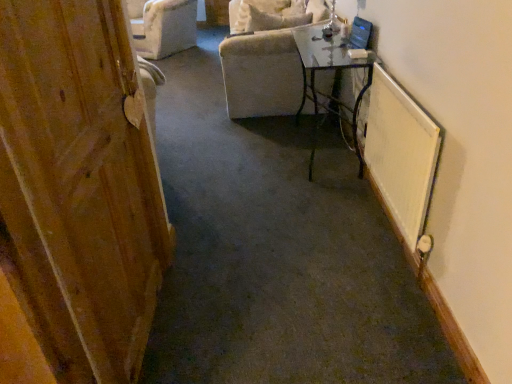
Question: Would you say velvet beige armchair at upper center is outside clear glass table at center?

Choices:
 (A) yes
 (B) no

Answer: (A)

Question: Considering the relative sizes of velvet beige armchair at upper center and clear glass table at center in the image provided, is velvet beige armchair at upper center smaller than clear glass table at center?

Choices:
 (A) no
 (B) yes

Answer: (B)

Question: From the image's perspective, would you say velvet beige armchair at upper center is shown under clear glass table at center?

Choices:
 (A) no
 (B) yes

Answer: (A)

Question: Is velvet beige armchair at upper center beside clear glass table at center?

Choices:
 (A) yes
 (B) no

Answer: (B)

Question: Considering the relative sizes of velvet beige armchair at upper center and clear glass table at center in the image provided, is velvet beige armchair at upper center shorter than clear glass table at center?

Choices:
 (A) yes
 (B) no

Answer: (A)

Question: Can you confirm if velvet beige armchair at upper center is taller than clear glass table at center?

Choices:
 (A) no
 (B) yes

Answer: (A)

Question: Would you say clear glass table at center contains velvet beige armchair at upper center?

Choices:
 (A) no
 (B) yes

Answer: (A)

Question: Is clear glass table at center positioned with its back to velvet beige armchair at upper center?

Choices:
 (A) yes
 (B) no

Answer: (B)

Question: From the image's perspective, would you say clear glass table at center is positioned over velvet beige armchair at upper center?

Choices:
 (A) yes
 (B) no

Answer: (B)

Question: Can you confirm if clear glass table at center is wider than velvet beige armchair at upper center?

Choices:
 (A) no
 (B) yes

Answer: (B)

Question: Does clear glass table at center have a smaller size compared to velvet beige armchair at upper center?

Choices:
 (A) yes
 (B) no

Answer: (B)

Question: Is clear glass table at center not within velvet beige armchair at upper center?

Choices:
 (A) no
 (B) yes

Answer: (B)

Question: Can you confirm if white textured radiator at right is positioned to the left of wooden door at left?

Choices:
 (A) no
 (B) yes

Answer: (A)